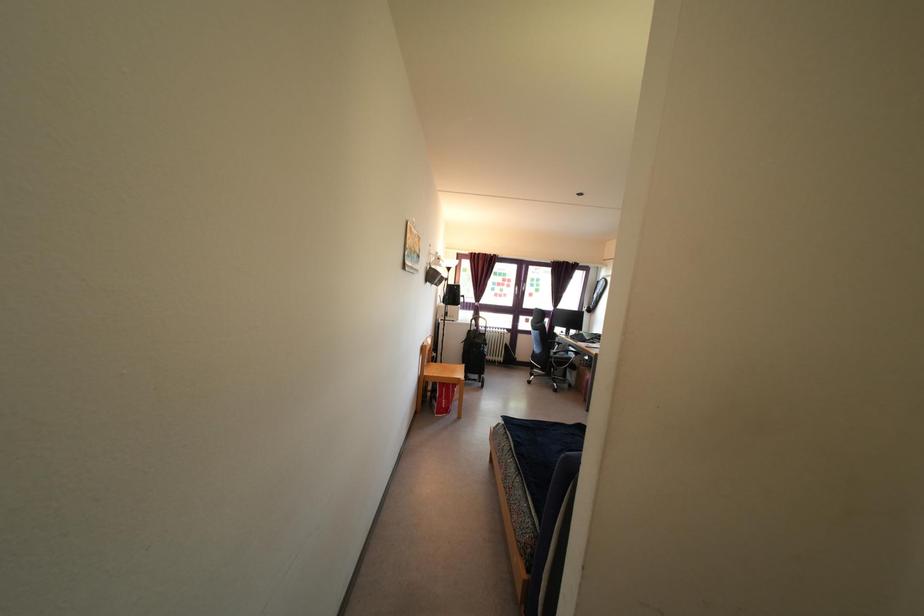
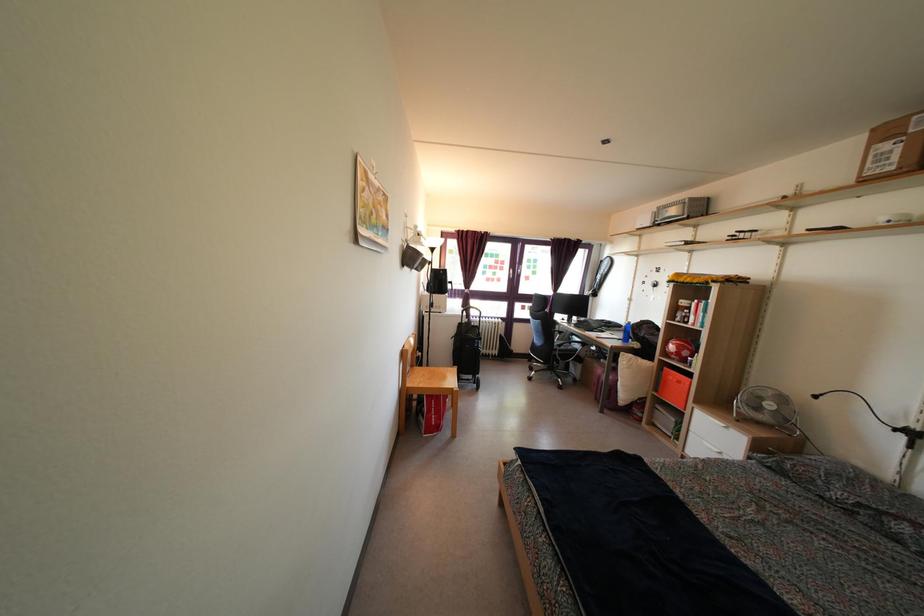
Question: The first image is from the beginning of the video and the second image is from the end. How did the camera likely rotate when shooting the video?

Choices:
 (A) Left
 (B) Right
 (C) Up
 (D) Down

Answer: (D)